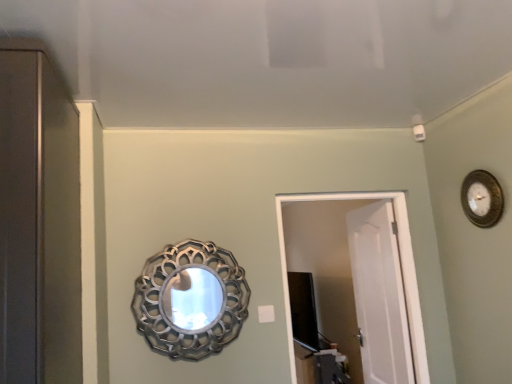
Image resolution: width=512 pixels, height=384 pixels. What do you see at coordinates (266, 314) in the screenshot? I see `white plastic light switch at center` at bounding box center [266, 314].

Find the location of a particular element. The width and height of the screenshot is (512, 384). white matte door at center, arranged as the 2th door when viewed from the back is located at coordinates (401, 266).

Locate an element on the screen. The width and height of the screenshot is (512, 384). white plastic light switch at center is located at coordinates (266, 314).

In the scene shown: Considering the sizes of objects white matte door at center, arranged as the 2th door when viewed from the back, and gold textured clock at upper right in the image provided, who is bigger, white matte door at center, arranged as the 2th door when viewed from the back, or gold textured clock at upper right?

Bigger between the two is white matte door at center, arranged as the 2th door when viewed from the back.

Is point (414, 354) positioned before point (495, 191)?

No, it is behind (495, 191).

From the image's perspective, is white matte door at center, the 1th door from the front, above gold textured clock at upper right?

Incorrect, from the image's perspective, white matte door at center, the 1th door from the front, is lower than gold textured clock at upper right.

Is metallic silver mirror at center oriented towards black glossy tv at center?

No.

Visually, is metallic silver mirror at center positioned to the left or to the right of black glossy tv at center?

From the image, it's evident that metallic silver mirror at center is to the left of black glossy tv at center.

In the scene shown: Is metallic silver mirror at center inside the boundaries of black glossy tv at center, or outside?

metallic silver mirror at center lies outside black glossy tv at center.

Is metallic silver mirror at center positioned behind black glossy tv at center?

No, metallic silver mirror at center is in front of black glossy tv at center.

Considering the relative sizes of white matte door at center, acting as the second door starting from the front, and gold textured clock at upper right in the image provided, is white matte door at center, acting as the second door starting from the front, thinner than gold textured clock at upper right?

No, white matte door at center, acting as the second door starting from the front, is not thinner than gold textured clock at upper right.

Is white matte door at center, acting as the second door starting from the front, facing away from gold textured clock at upper right?

No, white matte door at center, acting as the second door starting from the front,'s orientation is not away from gold textured clock at upper right.

Who is taller, white matte door at center, the first door in the back-to-front sequence, or gold textured clock at upper right?

With more height is white matte door at center, the first door in the back-to-front sequence.

From the image's perspective, is metallic silver mirror at center located above white matte door at center, acting as the second door starting from the front?

Yes, from the image's perspective, metallic silver mirror at center is above white matte door at center, acting as the second door starting from the front.

In the scene shown: Considering the sizes of metallic silver mirror at center and white matte door at center, the first door in the back-to-front sequence, in the image, is metallic silver mirror at center wider or thinner than white matte door at center, the first door in the back-to-front sequence,?

In the image, metallic silver mirror at center appears to be more narrow than white matte door at center, the first door in the back-to-front sequence.

In the image, is metallic silver mirror at center positioned in front of or behind white matte door at center, acting as the second door starting from the front?

In the image, metallic silver mirror at center appears in front of white matte door at center, acting as the second door starting from the front.

From a real-world perspective, is metallic silver mirror at center positioned above or below white matte door at center, acting as the second door starting from the front?

Clearly, from a real-world perspective, metallic silver mirror at center is above white matte door at center, acting as the second door starting from the front.

Is white plastic light switch at center in front of or behind black glossy tv at center in the image?

Clearly, white plastic light switch at center is in front of black glossy tv at center.

Does white plastic light switch at center turn towards black glossy tv at center?

No, white plastic light switch at center is not aimed at black glossy tv at center.

Between white plastic light switch at center and black glossy tv at center, which one appears on the left side from the viewer's perspective?

From the viewer's perspective, white plastic light switch at center appears more on the left side.

Is white matte door at center, acting as the second door starting from the front, bigger than white plastic light switch at center?

Correct, white matte door at center, acting as the second door starting from the front, is larger in size than white plastic light switch at center.

Does point (391, 234) come behind point (263, 312)?

Yes.

Can white plastic light switch at center be found inside white matte door at center, acting as the second door starting from the front?

No, white plastic light switch at center is not a part of white matte door at center, acting as the second door starting from the front.

From a real-world perspective, is white matte door at center, the first door in the back-to-front sequence, positioned above or below white plastic light switch at center?

Clearly, from a real-world perspective, white matte door at center, the first door in the back-to-front sequence, is below white plastic light switch at center.

Could you tell me if metallic silver mirror at center is turned towards white matte door at center, arranged as the 2th door when viewed from the back?

No, metallic silver mirror at center is not oriented towards white matte door at center, arranged as the 2th door when viewed from the back.

Between metallic silver mirror at center and white matte door at center, the 1th door from the front, which one is positioned behind?

Positioned behind is white matte door at center, the 1th door from the front.

How much distance is there between metallic silver mirror at center and white matte door at center, arranged as the 2th door when viewed from the back?

A distance of 2.25 meters exists between metallic silver mirror at center and white matte door at center, arranged as the 2th door when viewed from the back.

Locate an element on the screen. This screenshot has width=512, height=384. mirror above the white matte door at center, arranged as the 2th door when viewed from the back (from a real-world perspective) is located at coordinates (191, 299).

From the image's perspective, which door is the 1st one below the gold textured clock at upper right? Please provide its 2D coordinates.

[(401, 266)]

I want to click on medicine cabinet behind the metallic silver mirror at center, so click(303, 310).

Based on their spatial positions, is metallic silver mirror at center or black glossy tv at center further from gold textured clock at upper right?

metallic silver mirror at center.

Considering their positions, is metallic silver mirror at center positioned closer to black glossy tv at center than white matte door at center, the first door in the back-to-front sequence?

white matte door at center, the first door in the back-to-front sequence, lies closer to black glossy tv at center than the other object.

Considering their positions, is black glossy tv at center positioned further to gold textured clock at upper right than white plastic light switch at center?

black glossy tv at center is positioned further to the anchor gold textured clock at upper right.

Based on their spatial positions, is white matte door at center, the first door in the back-to-front sequence, or black glossy tv at center further from white matte door at center, arranged as the 2th door when viewed from the back?

The object further to white matte door at center, arranged as the 2th door when viewed from the back, is black glossy tv at center.

Based on their spatial positions, is white plastic light switch at center or black glossy tv at center closer to gold textured clock at upper right?

Based on the image, white plastic light switch at center appears to be nearer to gold textured clock at upper right.

Looking at the image, which one is located further to gold textured clock at upper right, metallic silver mirror at center or white matte door at center, the 1th door from the front?

metallic silver mirror at center lies further to gold textured clock at upper right than the other object.

Considering their positions, is gold textured clock at upper right positioned closer to metallic silver mirror at center than black glossy tv at center?

The object closer to metallic silver mirror at center is black glossy tv at center.

Which object lies nearer to the anchor point black glossy tv at center, metallic silver mirror at center or gold textured clock at upper right?

metallic silver mirror at center.

Where is `light switch between metallic silver mirror at center and gold textured clock at upper right in the horizontal direction`? This screenshot has height=384, width=512. light switch between metallic silver mirror at center and gold textured clock at upper right in the horizontal direction is located at coordinates (266, 314).

This screenshot has height=384, width=512. Find the location of `door between white plastic light switch at center and white matte door at center, the first door in the back-to-front sequence, in the horizontal direction`. door between white plastic light switch at center and white matte door at center, the first door in the back-to-front sequence, in the horizontal direction is located at coordinates (401, 266).

Find the location of a particular element. The width and height of the screenshot is (512, 384). light switch between metallic silver mirror at center and white matte door at center, the first door in the back-to-front sequence is located at coordinates (266, 314).

This screenshot has height=384, width=512. In order to click on mirror positioned between gold textured clock at upper right and black glossy tv at center from near to far in this screenshot , I will do `click(191, 299)`.